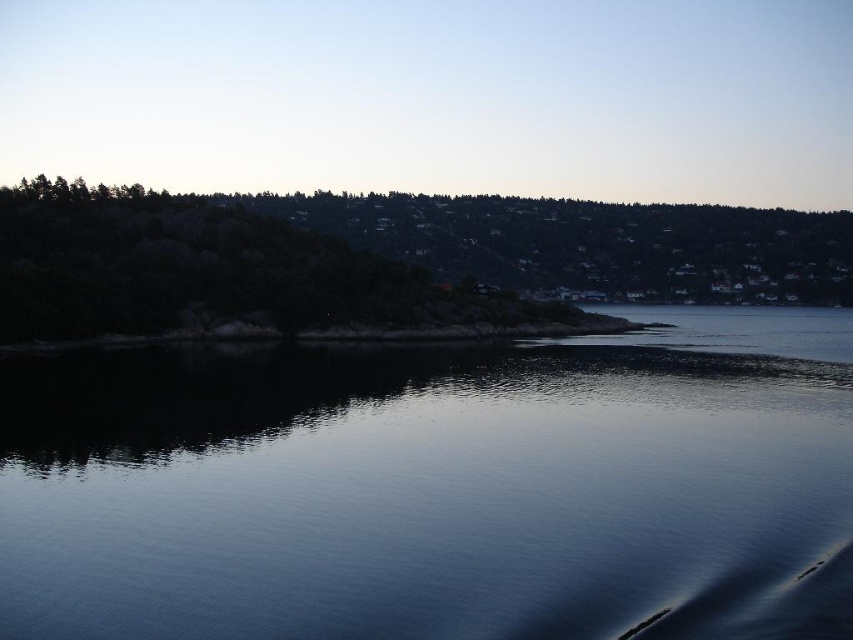
Measure the distance between dark reflective water at center and green textured rock at upper center.

They are 106.08 meters apart.

The image size is (853, 640). What do you see at coordinates (437, 486) in the screenshot?
I see `dark reflective water at center` at bounding box center [437, 486].

Image resolution: width=853 pixels, height=640 pixels. What do you see at coordinates (437, 486) in the screenshot?
I see `dark reflective water at center` at bounding box center [437, 486].

The image size is (853, 640). I want to click on dark reflective water at center, so click(437, 486).